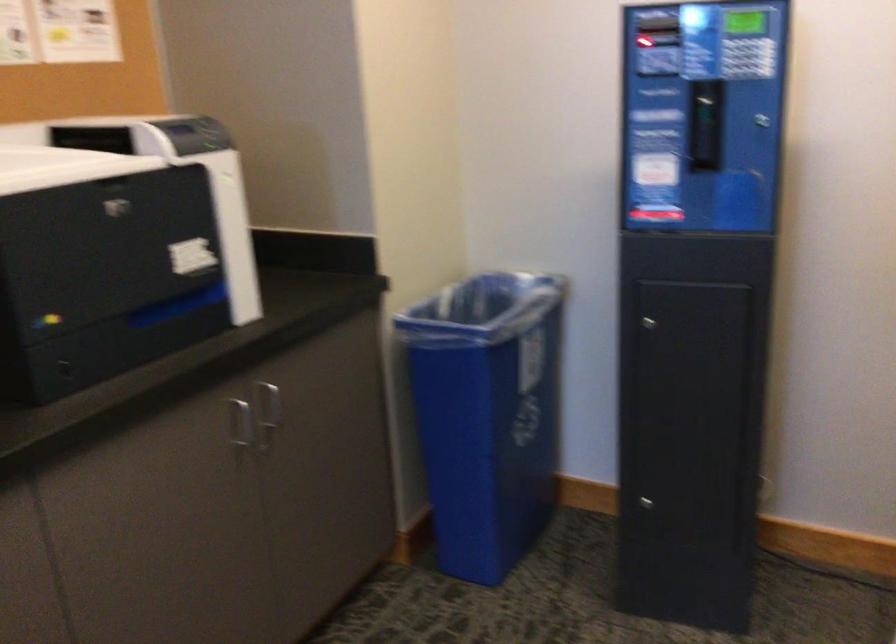
Where is `machine card slot`? The width and height of the screenshot is (896, 644). machine card slot is located at coordinates (655, 212).